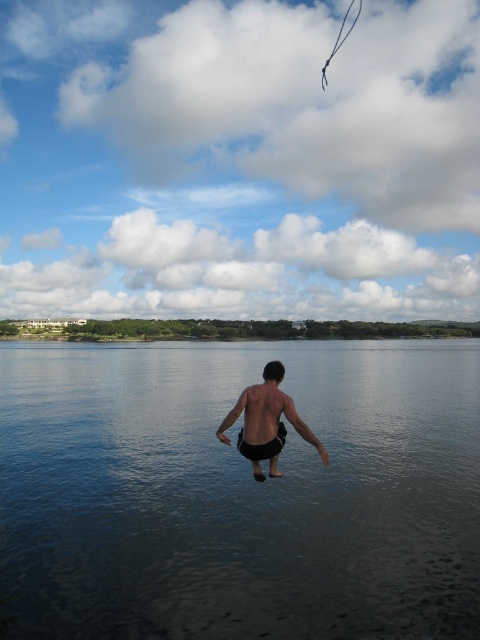
Question: Does dark blue water at center appear on the left side of black matte shorts at center?

Choices:
 (A) no
 (B) yes

Answer: (A)

Question: Does dark blue water at center have a lesser width compared to black matte shorts at center?

Choices:
 (A) no
 (B) yes

Answer: (A)

Question: Which object appears closest to the camera in this image?

Choices:
 (A) dark blue water at center
 (B) black matte shorts at center

Answer: (B)

Question: Is dark blue water at center to the right of black matte shorts at center from the viewer's perspective?

Choices:
 (A) no
 (B) yes

Answer: (B)